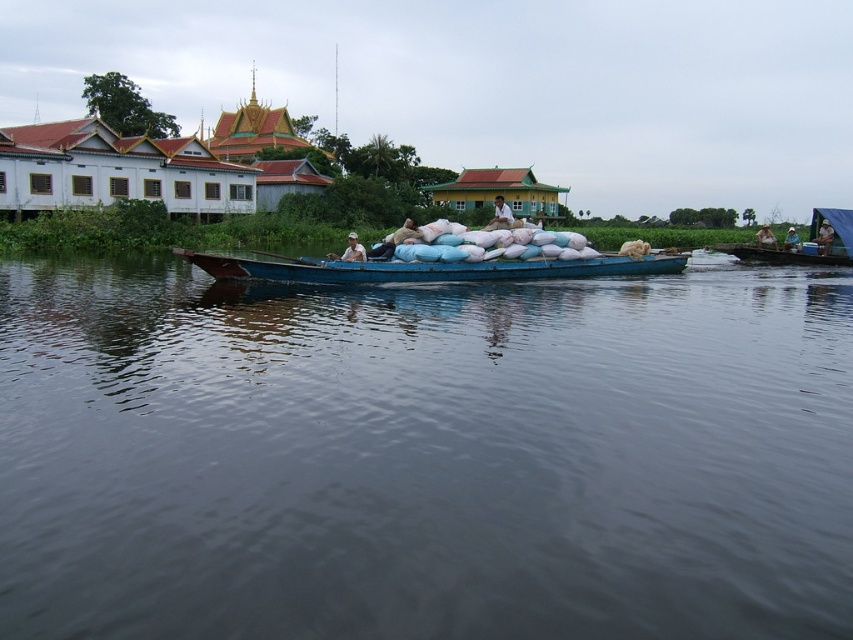
You are navigating a boat in the river scene and need to drop an anchor into the dark blue water at center. According to the coordinates provided, where exactly should you aim to place the anchor?

The dark blue water at center is located at point (424, 456), so you should aim for those coordinates to drop the anchor there.

You are a tailor observing the clothing items in the scene. You need to determine which item requires more fabric to make between the white fabric shirt at center and the white fabric hat at center. Based on the description, which one would need more fabric?

The white fabric shirt at center requires more fabric than the white fabric hat at center because its width is larger, indicating it might cover a larger area of the body.